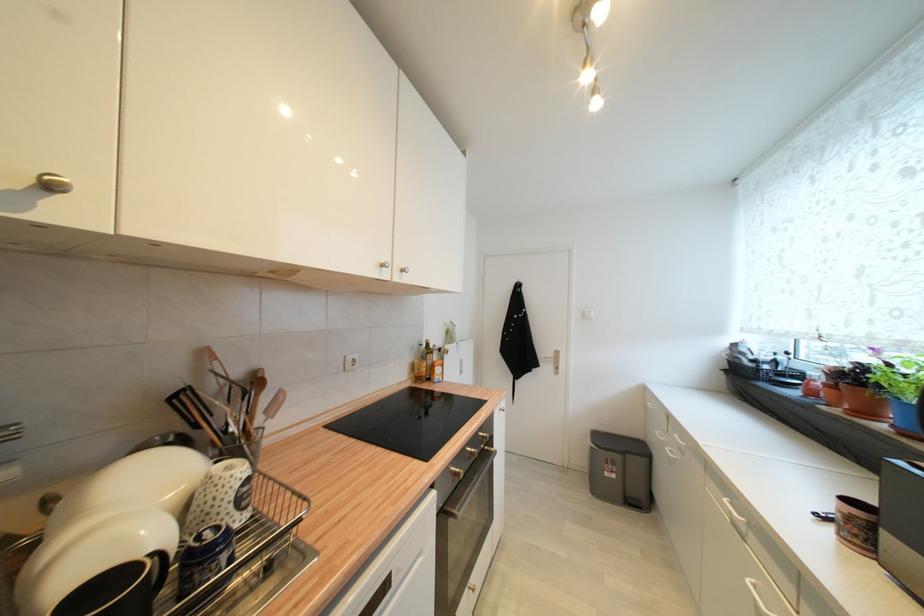
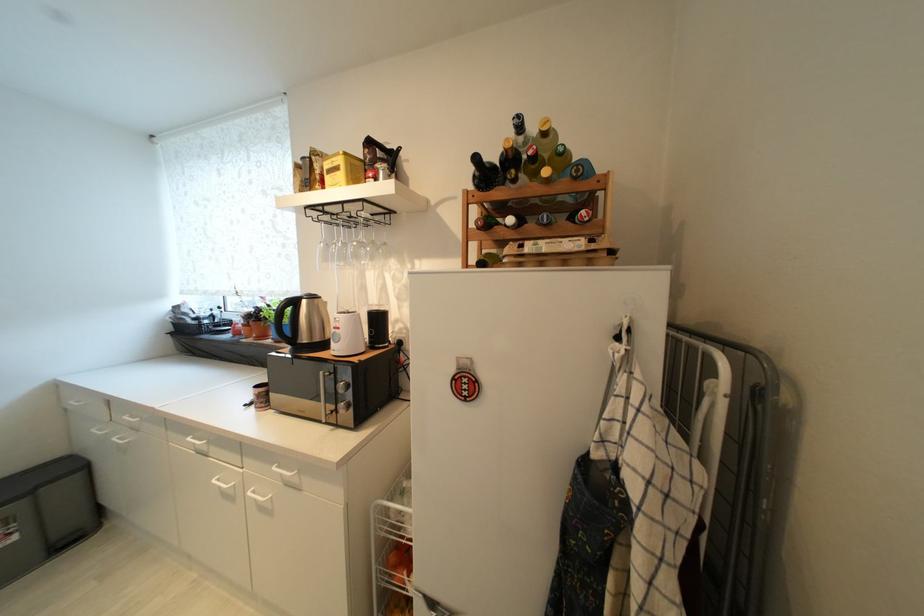
Question: Based on the continuous images, in which direction is the camera rotating? Reply with the corresponding letter.

Choices:
 (A) Left
 (B) Right
 (C) Up
 (D) Down

Answer: (B)